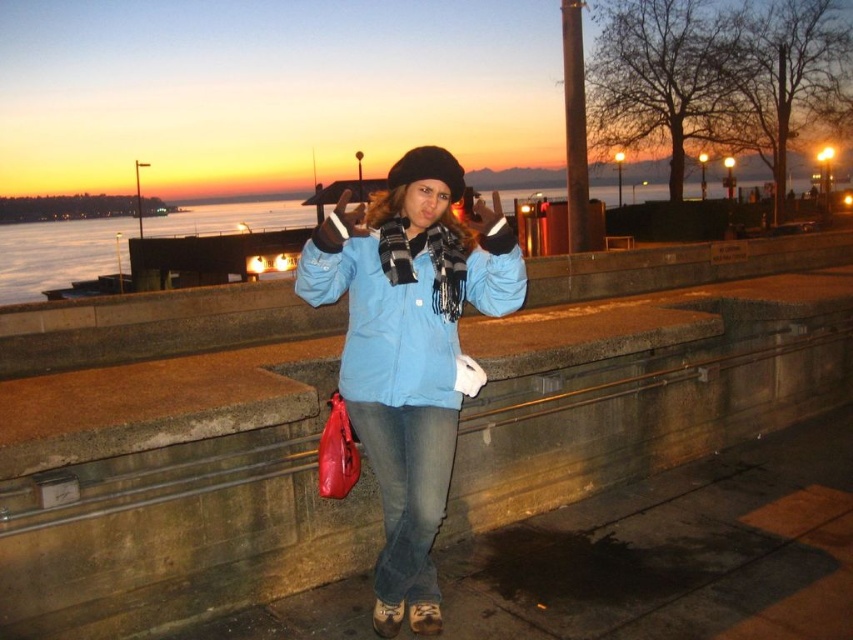
Question: Which point is closer to the camera taking this photo?

Choices:
 (A) (415, 515)
 (B) (502, 296)
 (C) (577, 314)
 (D) (381, 499)

Answer: (A)

Question: From the image, what is the correct spatial relationship of concrete at center in relation to matte blue jacket at center?

Choices:
 (A) right
 (B) left

Answer: (B)

Question: Among these objects, which one is farthest from the camera?

Choices:
 (A) matte blue jacket at center
 (B) blue matte jacket at center
 (C) denim jeans at center
 (D) concrete at center

Answer: (C)

Question: Can you confirm if concrete at center is positioned to the left of blue matte jacket at center?

Choices:
 (A) no
 (B) yes

Answer: (B)

Question: Does concrete at center appear on the left side of matte blue jacket at center?

Choices:
 (A) yes
 (B) no

Answer: (A)

Question: Which of the following is the closest to the observer?

Choices:
 (A) concrete at center
 (B) matte blue jacket at center

Answer: (B)